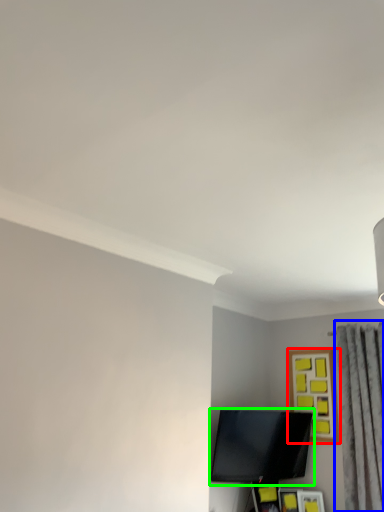
Question: Which object is the closest to the picture frame (highlighted by a red box)? Choose among these: curtain (highlighted by a blue box) or television (highlighted by a green box).

Choices:
 (A) curtain
 (B) television

Answer: (A)